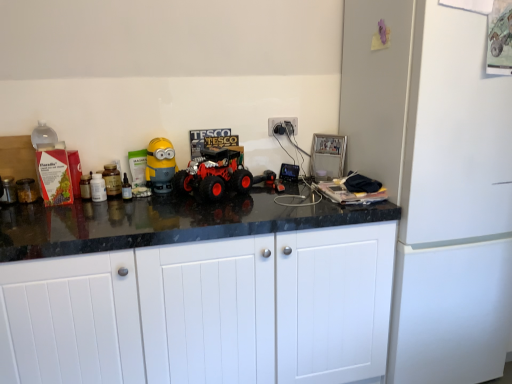
You are a GUI agent. You are given a task and a screenshot of the screen. Output one action in this format:
    pyautogui.click(x=<x>, y=<y>)
    Task: Click on the space that is in front of rubberized red toy truck at center
    
    Given the screenshot: What is the action you would take?
    pyautogui.click(x=243, y=210)